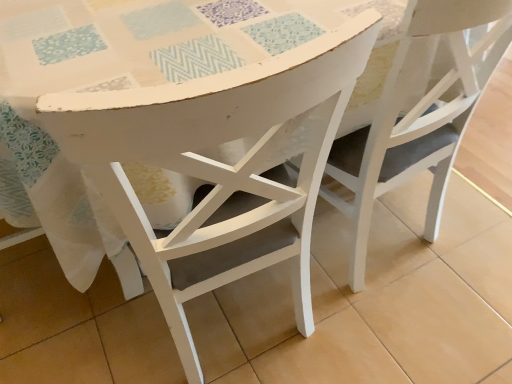
Question: Is white matte chair at center, the first chair viewed from the left, in front of or behind white matte chair at center, marked as the 2th chair in a left-to-right arrangement, in the image?

Choices:
 (A) front
 (B) behind

Answer: (A)

Question: From the image's perspective, relative to white matte chair at center, acting as the first chair starting from the right, is white matte chair at center, the first chair viewed from the left, above or below?

Choices:
 (A) above
 (B) below

Answer: (B)

Question: Visually, is white matte chair at center, arranged as the second chair when viewed from the right, positioned to the left or to the right of white matte chair at center, marked as the 2th chair in a left-to-right arrangement?

Choices:
 (A) right
 (B) left

Answer: (B)

Question: Which is correct: white matte chair at center, acting as the first chair starting from the right, is inside white matte chair at center, the first chair viewed from the left, or outside of it?

Choices:
 (A) inside
 (B) outside

Answer: (B)

Question: Is white matte chair at center, acting as the first chair starting from the right, taller or shorter than white matte chair at center, the first chair viewed from the left?

Choices:
 (A) tall
 (B) short

Answer: (B)

Question: Is point (498, 39) positioned closer to the camera than point (84, 107)?

Choices:
 (A) closer
 (B) farther

Answer: (B)

Question: Considering the relative positions of white matte chair at center, marked as the 2th chair in a left-to-right arrangement, and white matte chair at center, arranged as the second chair when viewed from the right, in the image provided, is white matte chair at center, marked as the 2th chair in a left-to-right arrangement, to the left or to the right of white matte chair at center, arranged as the second chair when viewed from the right,?

Choices:
 (A) right
 (B) left

Answer: (A)